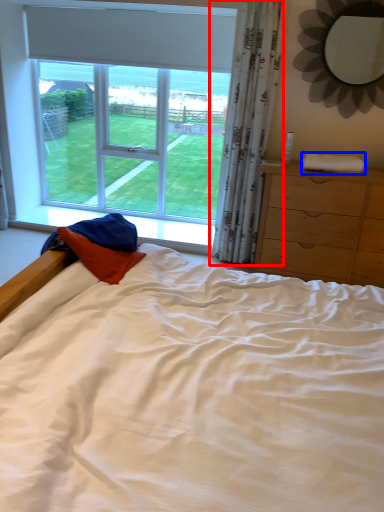
Question: Which point is further to the camera, curtain (highlighted by a red box) or cloth (highlighted by a blue box)?

Choices:
 (A) curtain
 (B) cloth

Answer: (B)